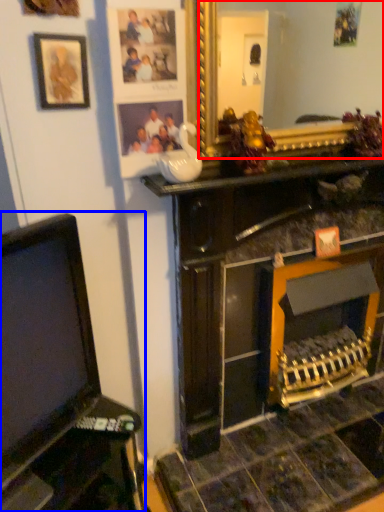
Question: Which point is further to the camera, mirror (highlighted by a red box) or furniture (highlighted by a blue box)?

Choices:
 (A) mirror
 (B) furniture

Answer: (A)